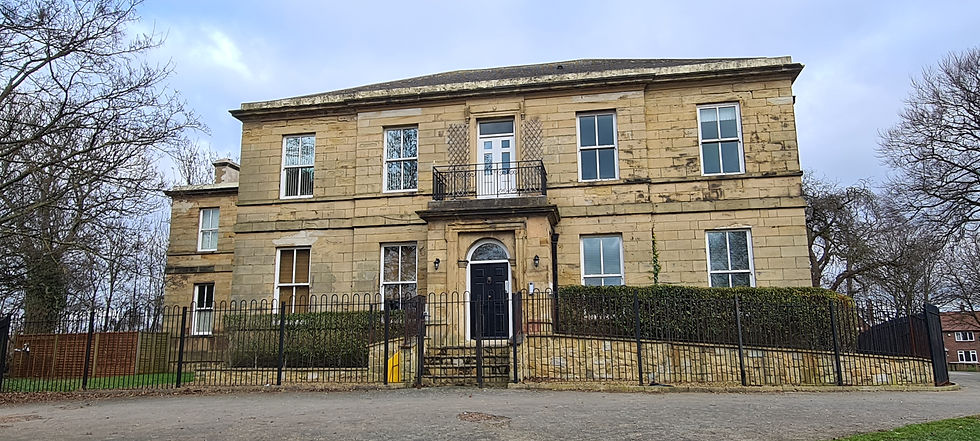
I want to click on white door, so click(487, 176).